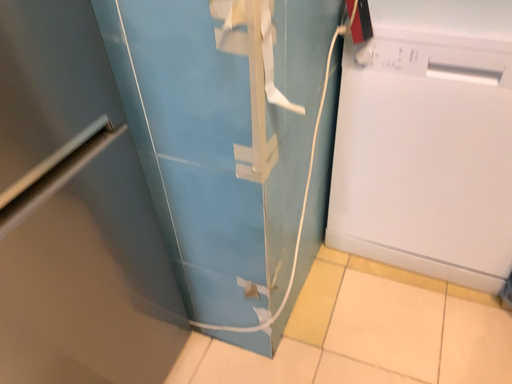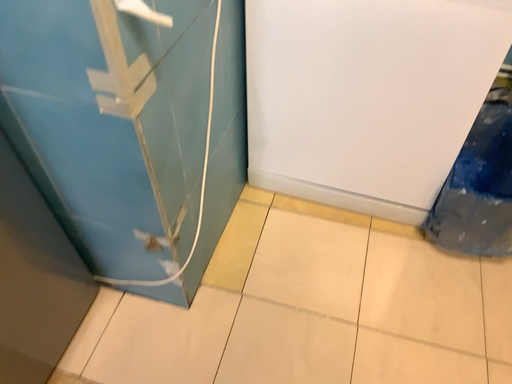
Question: How did the camera likely rotate when shooting the video?

Choices:
 (A) rotated upward
 (B) rotated downward

Answer: (B)